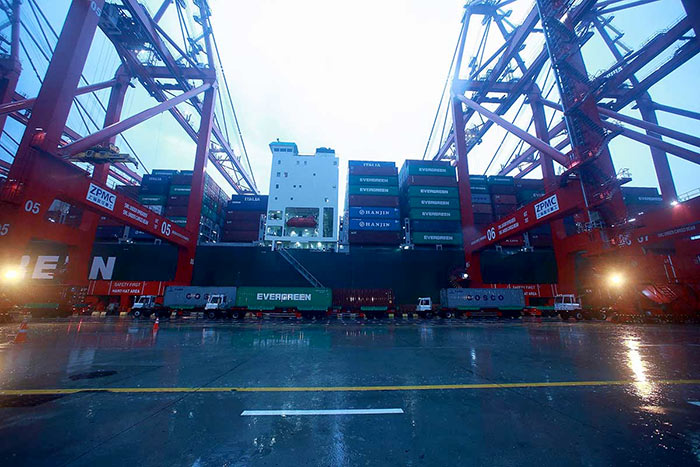
Find the location of a particular element. The height and width of the screenshot is (467, 700). stairs is located at coordinates (300, 267).